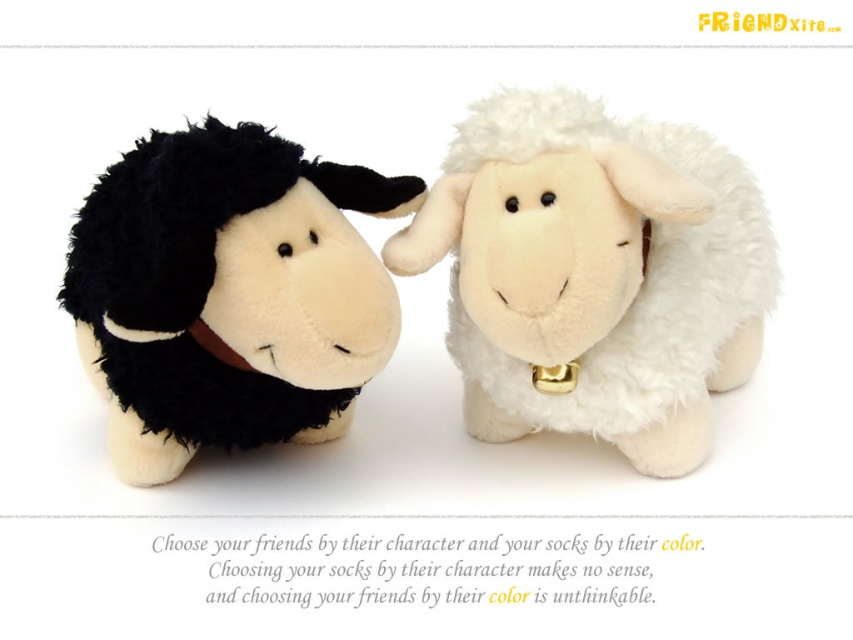
Is black plush sheep at left above brown fabric neckband at left?

Yes.

In the scene shown: Between black plush sheep at left and brown fabric neckband at left, which one is positioned higher?

black plush sheep at left is higher up.

Does point (254, 424) come behind point (195, 332)?

Yes, it is.

At what (x,y) coordinates should I click in order to perform the action: click on black plush sheep at left. Please return your answer as a coordinate pair (x, y). Looking at the image, I should click on 229,292.

Is point (717, 314) behind point (216, 388)?

Yes, it is.

Is point (630, 307) closer to viewer compared to point (236, 344)?

No, it is not.

Identify the location of white plush sheep at center. This screenshot has width=853, height=640. tap(595, 275).

Who is positioned more to the left, white plush sheep at center or brown fabric neckband at left?

Positioned to the left is brown fabric neckband at left.

Measure the distance between white plush sheep at center and brown fabric neckband at left.

white plush sheep at center is 15.24 inches away from brown fabric neckband at left.

Where is `white plush sheep at center`? The image size is (853, 640). white plush sheep at center is located at coordinates (595, 275).

Where is `white plush sheep at center`? The width and height of the screenshot is (853, 640). white plush sheep at center is located at coordinates (595, 275).